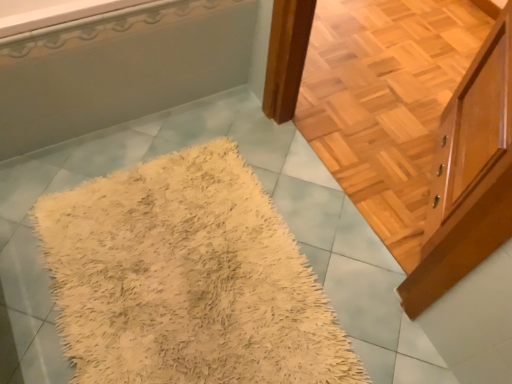
Locate an element on the screen. The width and height of the screenshot is (512, 384). free point above beige shaggy rug at center (from a real-world perspective) is located at coordinates (195, 241).